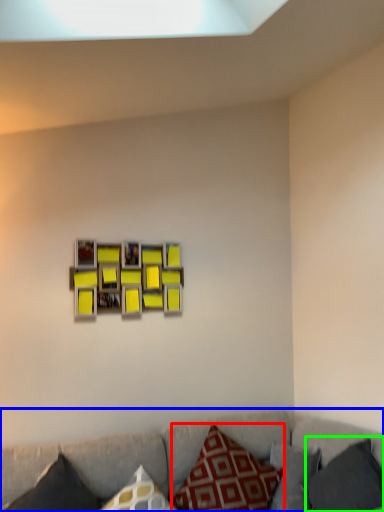
Question: Which object is positioned farthest from pillow (highlighted by a red box)? Select from studio couch (highlighted by a blue box) and pillow (highlighted by a green box).

Choices:
 (A) studio couch
 (B) pillow

Answer: (B)